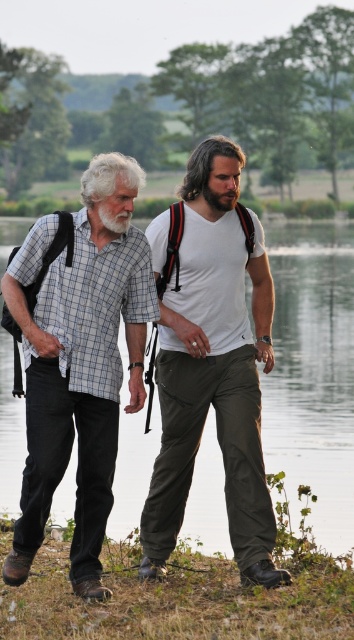
You are a photographer trying to capture a clear shot of both individuals in the scene. You notice two points in the image at coordinates point (197, 502) and point (220, 196). Which point is closer to your camera lens so you can focus properly?

Point (197, 502) is further to the viewer than point (220, 196), so the point closer to the camera lens is point (220, 196).

You are planning to cross the transparent water at center to reach the checkered fabric shirt at left. Based on the scene description, is the water level higher or lower than the shirt?

A: The transparent water at center is above the checkered fabric shirt at left, so the water level is higher than the shirt.